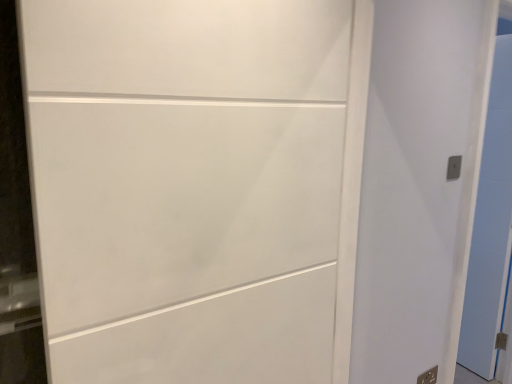
Question: Does white glossy door at right, which appears as the third door when viewed from the left, have a smaller size compared to white matte door at center, placed as the first door when sorted from front to back?

Choices:
 (A) no
 (B) yes

Answer: (B)

Question: From the image's perspective, is white glossy door at right, the 1th door when ordered from back to front, below white matte door at center, placed as the first door when sorted from front to back?

Choices:
 (A) no
 (B) yes

Answer: (B)

Question: Is white glossy door at right, marked as the first door in a right-to-left arrangement, at the right side of white matte door at center, placed as the 3th door when sorted from back to front?

Choices:
 (A) yes
 (B) no

Answer: (A)

Question: Is white matte door at center, placed as the 3th door when sorted from back to front, at the back of white glossy door at right, the third door positioned from the front?

Choices:
 (A) no
 (B) yes

Answer: (A)

Question: Is white glossy door at right, marked as the first door in a right-to-left arrangement, not within white matte door at center, the 1th door viewed from the left?

Choices:
 (A) yes
 (B) no

Answer: (A)

Question: From a real-world perspective, is white matte door at center, placed as the 3th door when sorted from back to front, above or below white glossy door at right, which appears as the third door when viewed from the left?

Choices:
 (A) above
 (B) below

Answer: (A)

Question: Considering the positions of white matte door at center, placed as the first door when sorted from front to back, and white glossy door at right, which appears as the third door when viewed from the left, in the image, is white matte door at center, placed as the first door when sorted from front to back, bigger or smaller than white glossy door at right, which appears as the third door when viewed from the left,?

Choices:
 (A) big
 (B) small

Answer: (A)

Question: Considering their positions, is white matte door at center, the 1th door viewed from the left, located in front of or behind white glossy door at right, the third door positioned from the front?

Choices:
 (A) front
 (B) behind

Answer: (A)

Question: Is white matte door at center, placed as the first door when sorted from front to back, taller or shorter than white glossy door at right, the 1th door when ordered from back to front?

Choices:
 (A) tall
 (B) short

Answer: (B)

Question: In terms of height, does white glossy door at right, which appears as the third door when viewed from the left, look taller or shorter compared to metallic silver outlet at lower right, arranged as the 2th electric outlet when viewed from the top?

Choices:
 (A) tall
 (B) short

Answer: (A)

Question: Which is correct: white glossy door at right, the third door positioned from the front, is inside metallic silver outlet at lower right, arranged as the 2th electric outlet when viewed from the top, or outside of it?

Choices:
 (A) outside
 (B) inside

Answer: (A)

Question: Is white glossy door at right, which appears as the third door when viewed from the left, wider or thinner than metallic silver outlet at lower right, which is counted as the 1th electric outlet, starting from the bottom?

Choices:
 (A) wide
 (B) thin

Answer: (A)

Question: Looking at the image, does white glossy door at right, marked as the first door in a right-to-left arrangement, seem bigger or smaller compared to metallic silver outlet at lower right, which is counted as the 1th electric outlet, starting from the back?

Choices:
 (A) big
 (B) small

Answer: (A)

Question: From a real-world perspective, is metallic silver outlet at lower right, which appears as the second electric outlet when viewed from the front, above or below white matte door at center, the 3th door positioned from the right?

Choices:
 (A) above
 (B) below

Answer: (B)

Question: Do you think metallic silver outlet at lower right, which appears as the second electric outlet when viewed from the front, is within white matte door at center, the 1th door viewed from the left, or outside of it?

Choices:
 (A) outside
 (B) inside

Answer: (A)